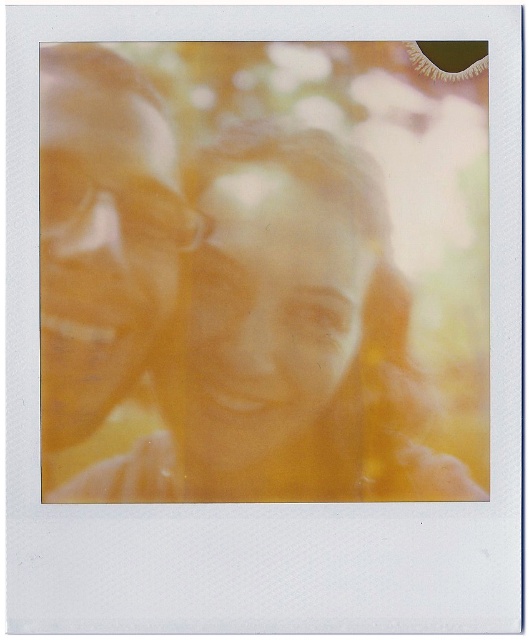
In the scene shown: You are looking at the Polaroid photo and want to determine which of the two points, point (272, 426) or point (141, 280), is nearer to the camera. Based on the description, which point is closer?

Point (272, 426) is closer to the camera than point (141, 280).

In the Polaroid photo with a warm, yellowish tone, there is a matte yellow hair at center and a smooth skin face at center. Based on their positions, which object is located to the left?

The matte yellow hair at center is positioned to the left of the smooth skin face at center.